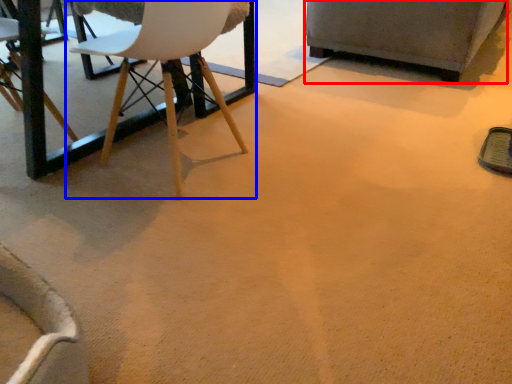
Question: Among these objects, which one is nearest to the camera, armchair (highlighted by a red box) or chair (highlighted by a blue box)?

Choices:
 (A) armchair
 (B) chair

Answer: (B)